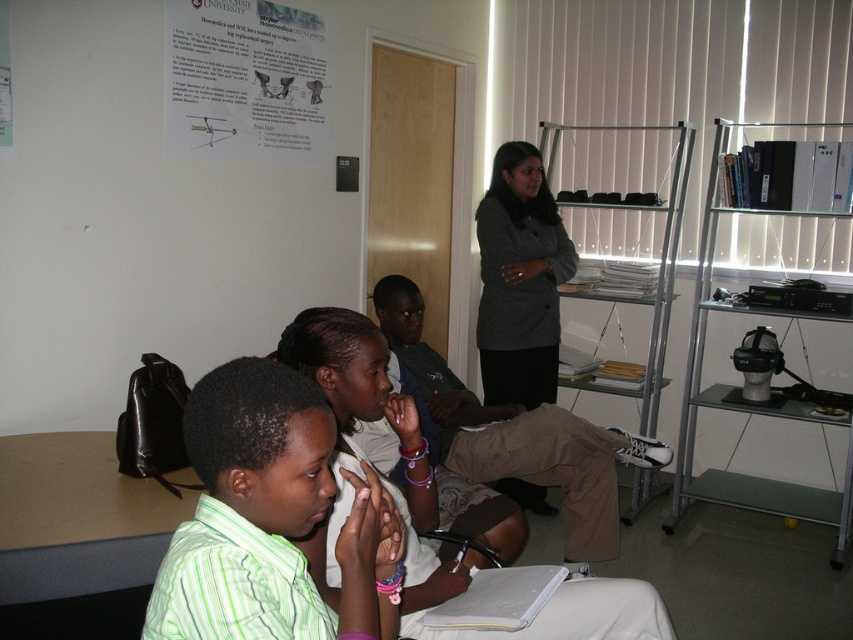
Is white paper at upper left shorter than light brown fabric pants at center?

Indeed, white paper at upper left has a lesser height compared to light brown fabric pants at center.

Who is positioned more to the right, white paper at upper left or light brown fabric pants at center?

Positioned to the right is light brown fabric pants at center.

Describe the element at coordinates (244, 81) in the screenshot. The width and height of the screenshot is (853, 640). I see `white paper at upper left` at that location.

Identify the location of white paper at upper left. This screenshot has height=640, width=853. (244, 81).

Which of these two, light brown fabric pants at center or dark gray blazer at center, stands taller?

dark gray blazer at center

Is light brown fabric pants at center shorter than dark gray blazer at center?

Indeed, light brown fabric pants at center has a lesser height compared to dark gray blazer at center.

The height and width of the screenshot is (640, 853). What do you see at coordinates (515, 435) in the screenshot?
I see `light brown fabric pants at center` at bounding box center [515, 435].

The image size is (853, 640). Identify the location of light brown fabric pants at center. (515, 435).

Does point (209, 579) come behind point (511, 316)?

That is False.

Where is `green striped shirt at center`? green striped shirt at center is located at coordinates point(271,518).